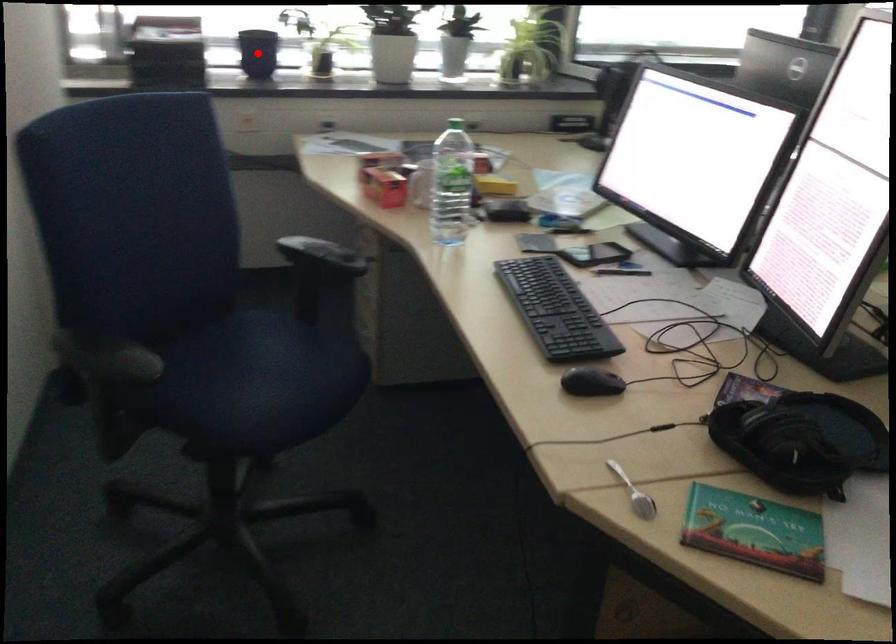
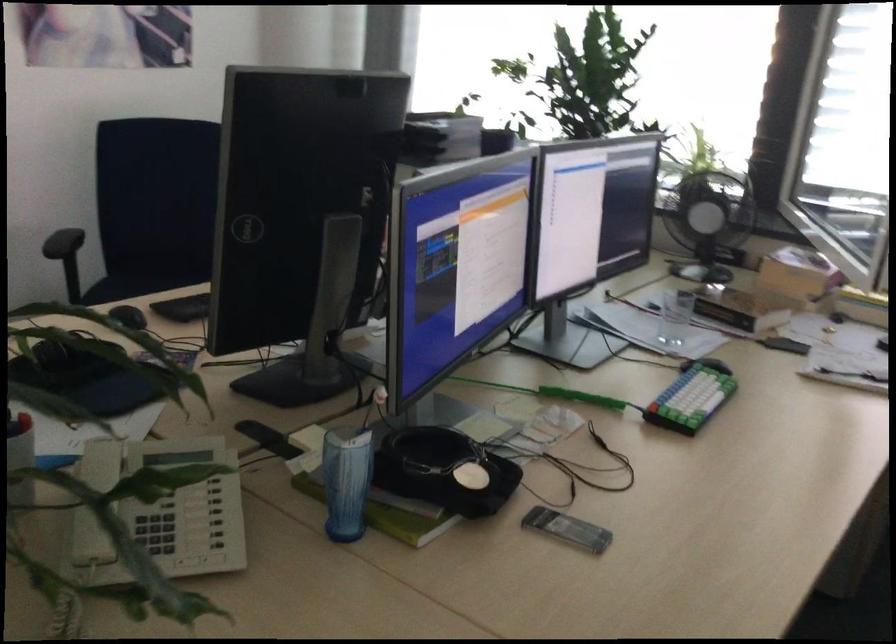
Question: I am providing you with two images of the same scene from different viewpoints. A red point is marked on the first image. Can you still see the location of the red point in image 2?

Choices:
 (A) Yes
 (B) No

Answer: (B)